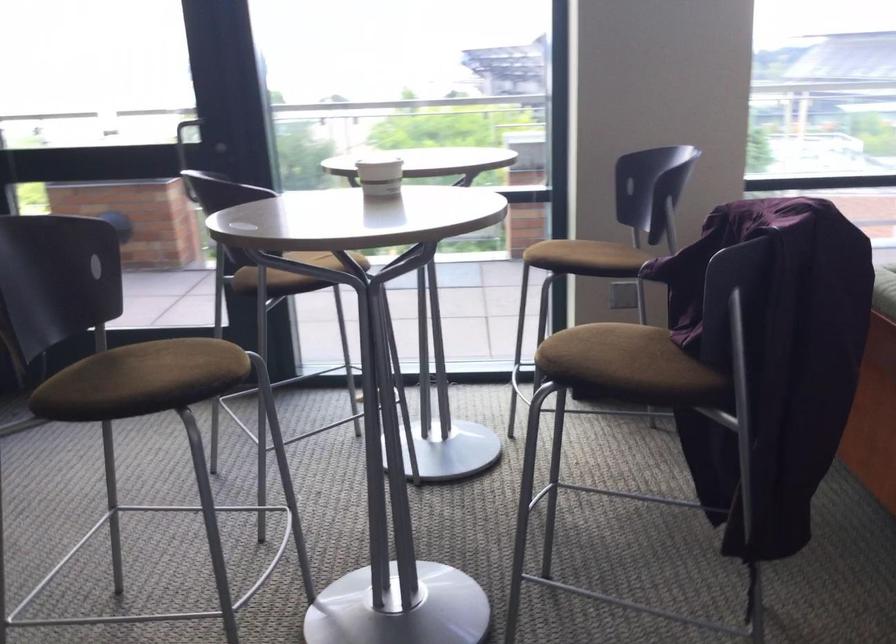
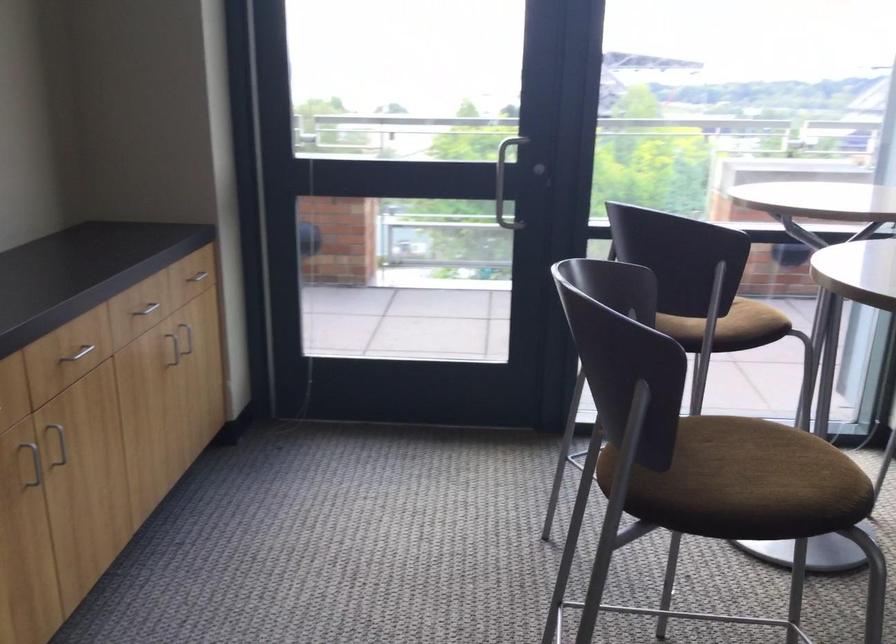
The point at [141,381] is marked in the first image. Where is the corresponding point in the second image?

(739, 482)